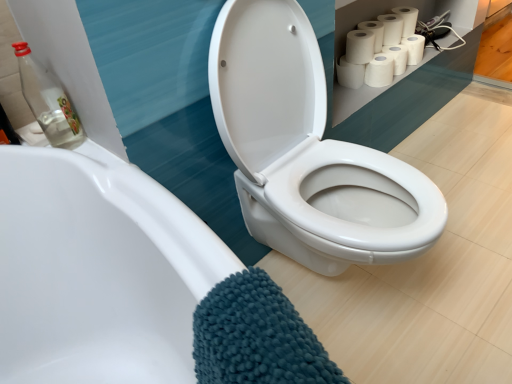
This screenshot has width=512, height=384. Identify the location of white matte toilet paper at upper right, which ranks as the second toilet paper in right-to-left order. (407, 19).

What do you see at coordinates (350, 73) in the screenshot? The width and height of the screenshot is (512, 384). I see `white matte toilet paper at upper right, positioned as the 1th toilet paper in left-to-right order` at bounding box center [350, 73].

Where is `white glossy toilet at center`? The width and height of the screenshot is (512, 384). white glossy toilet at center is located at coordinates (307, 151).

Identify the location of white matte paper towel at upper right. The image size is (512, 384). (360, 46).

Identify the location of teal chenille bath towel at lower left. The image size is (512, 384). (256, 336).

Find the location of `white matte toilet paper at upper right, which is the first toilet paper from right to left`. white matte toilet paper at upper right, which is the first toilet paper from right to left is located at coordinates (414, 48).

Considering the sizes of objects white matte toilet paper at upper right, arranged as the 2th toilet paper when viewed from the left, and white glossy toilet at center in the image provided, who is thinner, white matte toilet paper at upper right, arranged as the 2th toilet paper when viewed from the left, or white glossy toilet at center?

white matte toilet paper at upper right, arranged as the 2th toilet paper when viewed from the left, is thinner.

Is white matte toilet paper at upper right, arranged as the 2th toilet paper when viewed from the left, directly adjacent to white glossy toilet at center?

There is a gap between white matte toilet paper at upper right, arranged as the 2th toilet paper when viewed from the left, and white glossy toilet at center.

Is white matte toilet paper at upper right, arranged as the 2th toilet paper when viewed from the left, at the left side of white glossy toilet at center?

No, white matte toilet paper at upper right, arranged as the 2th toilet paper when viewed from the left, is not to the left of white glossy toilet at center.

From a real-world perspective, is transparent glass bottle at upper left located beneath white matte toilet paper at upper right, the third toilet paper in the left-to-right sequence?

No.

How much distance is there between transparent glass bottle at upper left and white matte toilet paper at upper right, positioned as the 5th toilet paper in right-to-left order?

transparent glass bottle at upper left is 1.11 meters away from white matte toilet paper at upper right, positioned as the 5th toilet paper in right-to-left order.

Is transparent glass bottle at upper left outside of white matte toilet paper at upper right, positioned as the 5th toilet paper in right-to-left order?

Absolutely, transparent glass bottle at upper left is external to white matte toilet paper at upper right, positioned as the 5th toilet paper in right-to-left order.

Would you say transparent glass bottle at upper left is a long distance from white matte toilet paper at upper right, positioned as the 5th toilet paper in right-to-left order?

Yes, transparent glass bottle at upper left and white matte toilet paper at upper right, positioned as the 5th toilet paper in right-to-left order, are quite far apart.

Considering the relative positions of white matte toilet paper at upper right, positioned as the 5th toilet paper in right-to-left order, and white matte toilet paper at upper right, positioned as the 7th toilet paper in right-to-left order, in the image provided, is white matte toilet paper at upper right, positioned as the 5th toilet paper in right-to-left order, to the right of white matte toilet paper at upper right, positioned as the 7th toilet paper in right-to-left order, from the viewer's perspective?

Correct, you'll find white matte toilet paper at upper right, positioned as the 5th toilet paper in right-to-left order, to the right of white matte toilet paper at upper right, positioned as the 7th toilet paper in right-to-left order.

Does white matte toilet paper at upper right, positioned as the 5th toilet paper in right-to-left order, have a smaller size compared to white matte toilet paper at upper right, positioned as the 1th toilet paper in left-to-right order?

No, white matte toilet paper at upper right, positioned as the 5th toilet paper in right-to-left order, is not smaller than white matte toilet paper at upper right, positioned as the 1th toilet paper in left-to-right order.

Find the location of a particular element. the 2nd toilet paper directly beneath the white matte toilet paper at upper right, the third toilet paper in the left-to-right sequence (from a real-world perspective) is located at coordinates (350, 73).

Can you tell me how much white matte toilet paper at upper right, positioned as the 5th toilet paper in right-to-left order, and white matte toilet paper at upper right, positioned as the 1th toilet paper in left-to-right order, differ in facing direction?

There is a 0.00153-degree angle between the facing directions of white matte toilet paper at upper right, positioned as the 5th toilet paper in right-to-left order, and white matte toilet paper at upper right, positioned as the 1th toilet paper in left-to-right order.

Is white matte toilet paper at upper right, the sixth toilet paper positioned from the left, bigger or smaller than white matte toilet paper at upper right, which is the first toilet paper from right to left?

white matte toilet paper at upper right, the sixth toilet paper positioned from the left, is bigger than white matte toilet paper at upper right, which is the first toilet paper from right to left.

Considering the sizes of objects white matte toilet paper at upper right, the sixth toilet paper positioned from the left, and white matte toilet paper at upper right, the 7th toilet paper when ordered from left to right, in the image provided, who is shorter, white matte toilet paper at upper right, the sixth toilet paper positioned from the left, or white matte toilet paper at upper right, the 7th toilet paper when ordered from left to right,?

white matte toilet paper at upper right, the 7th toilet paper when ordered from left to right, is shorter.

Considering the relative positions of white matte toilet paper at upper right, which ranks as the second toilet paper in right-to-left order, and white matte toilet paper at upper right, which is the first toilet paper from right to left, in the image provided, is white matte toilet paper at upper right, which ranks as the second toilet paper in right-to-left order, to the right of white matte toilet paper at upper right, which is the first toilet paper from right to left, from the viewer's perspective?

Incorrect, white matte toilet paper at upper right, which ranks as the second toilet paper in right-to-left order, is not on the right side of white matte toilet paper at upper right, which is the first toilet paper from right to left.

Considering the sizes of objects white matte toilet paper at upper right, the sixth toilet paper positioned from the left, and white glossy toilet at center in the image provided, who is taller, white matte toilet paper at upper right, the sixth toilet paper positioned from the left, or white glossy toilet at center?

white glossy toilet at center is taller.

From the picture: Would you say white matte toilet paper at upper right, the sixth toilet paper positioned from the left, is to the left or to the right of white glossy toilet at center in the picture?

white matte toilet paper at upper right, the sixth toilet paper positioned from the left, is positioned on white glossy toilet at center's right side.

Which point is more forward, (407, 8) or (354, 255)?

The point (354, 255) is more forward.

How much distance is there between white matte toilet paper at upper right, the third toilet paper in the left-to-right sequence, and white matte toilet paper at upper right, acting as the third toilet paper starting from the right?

2.68 inches.

Considering the relative positions of white matte toilet paper at upper right, the third toilet paper in the left-to-right sequence, and white matte toilet paper at upper right, acting as the third toilet paper starting from the right, in the image provided, is white matte toilet paper at upper right, the third toilet paper in the left-to-right sequence, to the left of white matte toilet paper at upper right, acting as the third toilet paper starting from the right, from the viewer's perspective?

Indeed, white matte toilet paper at upper right, the third toilet paper in the left-to-right sequence, is positioned on the left side of white matte toilet paper at upper right, acting as the third toilet paper starting from the right.

Is white matte toilet paper at upper right, the third toilet paper in the left-to-right sequence, taller or shorter than white matte toilet paper at upper right, acting as the third toilet paper starting from the right?

white matte toilet paper at upper right, the third toilet paper in the left-to-right sequence, is taller than white matte toilet paper at upper right, acting as the third toilet paper starting from the right.

You are a GUI agent. You are given a task and a screenshot of the screen. Output one action in this format:
    pyautogui.click(x=<x>, y=<y>)
    Task: Click on the toilet paper that is the 1st one when counting upward from the white matte toilet paper at upper right, the third toilet paper in the left-to-right sequence (from the image's perspective)
    
    Given the screenshot: What is the action you would take?
    pyautogui.click(x=397, y=57)

Is white matte toilet paper at upper right, which is the 6th toilet paper in right-to-left order, oriented away from white matte toilet paper at upper right, the sixth toilet paper positioned from the left?

white matte toilet paper at upper right, which is the 6th toilet paper in right-to-left order, does not have its back to white matte toilet paper at upper right, the sixth toilet paper positioned from the left.

Which object is closer to the camera taking this photo, white matte toilet paper at upper right, which is the 6th toilet paper in right-to-left order, or white matte toilet paper at upper right, the sixth toilet paper positioned from the left?

white matte toilet paper at upper right, which is the 6th toilet paper in right-to-left order, is closer to the camera.

From a real-world perspective, who is located higher, white matte toilet paper at upper right, arranged as the 2th toilet paper when viewed from the left, or white matte toilet paper at upper right, which ranks as the second toilet paper in right-to-left order?

white matte toilet paper at upper right, which ranks as the second toilet paper in right-to-left order, from a real-world perspective.

Choose the correct answer: Is white matte toilet paper at upper right, which is the 6th toilet paper in right-to-left order, inside white matte toilet paper at upper right, the sixth toilet paper positioned from the left, or outside it?

white matte toilet paper at upper right, which is the 6th toilet paper in right-to-left order, is located beyond the bounds of white matte toilet paper at upper right, the sixth toilet paper positioned from the left.

The image size is (512, 384). Identify the location of toilet in front of the white matte toilet paper at upper right, arranged as the 2th toilet paper when viewed from the left. coord(307,151).

From the transparent glass bottle at upper left, count 1st toilet papers backward and point to it. Please provide its 2D coordinates.

[(379, 70)]

Which object lies further to the anchor point white matte toilet paper at upper right, positioned as the 7th toilet paper in right-to-left order, white glossy toilet at center or white matte toilet paper at upper right, which is the first toilet paper from right to left?

Based on the image, white glossy toilet at center appears to be further to white matte toilet paper at upper right, positioned as the 7th toilet paper in right-to-left order.

Estimate the real-world distances between objects in this image. Which object is further from white matte paper towel at upper right, teal chenille bath towel at lower left or white matte toilet paper at upper right, which is the 4th toilet paper in left-to-right order?

Based on the image, teal chenille bath towel at lower left appears to be further to white matte paper towel at upper right.

From the image, which object appears to be nearer to white matte toilet paper at upper right, which is the 4th toilet paper in left-to-right order, white matte toilet paper at upper right, which is the 6th toilet paper in right-to-left order, or white matte toilet paper at upper right, which ranks as the second toilet paper in right-to-left order?

Among the two, white matte toilet paper at upper right, which is the 6th toilet paper in right-to-left order, is located nearer to white matte toilet paper at upper right, which is the 4th toilet paper in left-to-right order.

When comparing their distances from white glossy toilet at center, does white matte toilet paper at upper right, acting as the third toilet paper starting from the right, or white matte toilet paper at upper right, arranged as the 2th toilet paper when viewed from the left, seem further?

The object further to white glossy toilet at center is white matte toilet paper at upper right, acting as the third toilet paper starting from the right.

Looking at the image, which one is located closer to white matte toilet paper at upper right, marked as the 5th toilet paper in a left-to-right arrangement, white matte toilet paper at upper right, which ranks as the second toilet paper in right-to-left order, or white glossy toilet at center?

Among the two, white matte toilet paper at upper right, which ranks as the second toilet paper in right-to-left order, is located nearer to white matte toilet paper at upper right, marked as the 5th toilet paper in a left-to-right arrangement.

Looking at the image, which one is located further to white matte toilet paper at upper right, the sixth toilet paper positioned from the left, white glossy toilet at center or transparent glass bottle at upper left?

transparent glass bottle at upper left lies further to white matte toilet paper at upper right, the sixth toilet paper positioned from the left, than the other object.

Estimate the real-world distances between objects in this image. Which object is further from white matte toilet paper at upper right, the sixth toilet paper positioned from the left, white matte toilet paper at upper right, acting as the third toilet paper starting from the right, or white matte paper towel at upper right?

white matte paper towel at upper right lies further to white matte toilet paper at upper right, the sixth toilet paper positioned from the left, than the other object.

Looking at the image, which one is located closer to white matte toilet paper at upper right, the 7th toilet paper when ordered from left to right, white matte toilet paper at upper right, the sixth toilet paper positioned from the left, or white matte paper towel at upper right?

The object closer to white matte toilet paper at upper right, the 7th toilet paper when ordered from left to right, is white matte toilet paper at upper right, the sixth toilet paper positioned from the left.

Identify the location of paper towel located between white matte toilet paper at upper right, positioned as the 7th toilet paper in right-to-left order, and white matte toilet paper at upper right, positioned as the 5th toilet paper in right-to-left order, in the left-right direction. This screenshot has width=512, height=384. (360, 46).

Identify the location of paper towel between transparent glass bottle at upper left and white matte toilet paper at upper right, which ranks as the second toilet paper in right-to-left order, in the horizontal direction. This screenshot has width=512, height=384. (360, 46).

At what (x,y) coordinates should I click in order to perform the action: click on paper towel between white glossy toilet at center and white matte toilet paper at upper right, the sixth toilet paper positioned from the left, from front to back. Please return your answer as a coordinate pair (x, y). The width and height of the screenshot is (512, 384). Looking at the image, I should click on tap(360, 46).

I want to click on paper towel between white glossy toilet at center and white matte toilet paper at upper right, which is the 4th toilet paper in left-to-right order, from front to back, so click(360, 46).